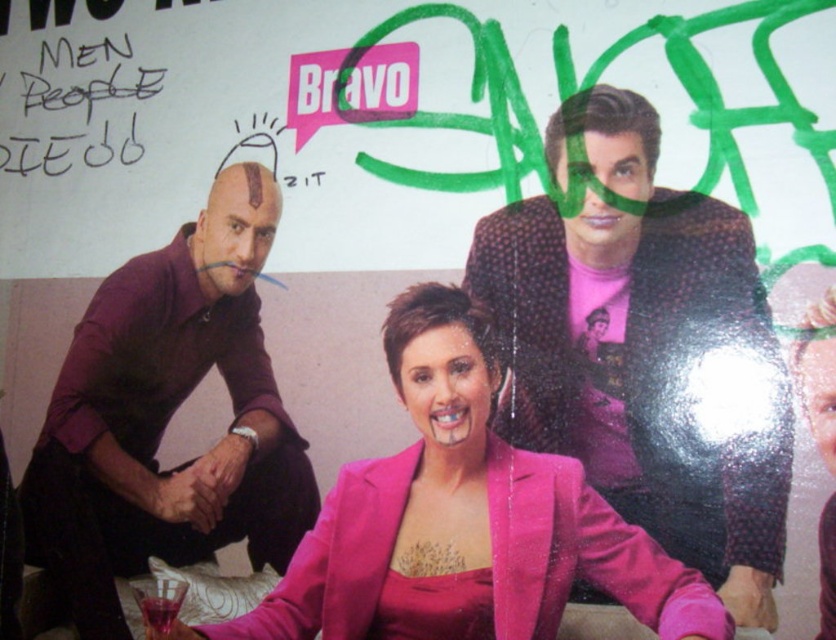
You are designing a poster layout and need to ensure that the pink satin blazer at center and the black handwritten text at upper left are both visible. Given their sizes, which object should be placed closer to the viewer to maintain visual balance?

The pink satin blazer at center is larger than the black handwritten text at upper left, so to maintain visual balance, the black handwritten text at upper left should be placed closer to the viewer than the pink satin blazer at center.

You are a costume designer looking at the poster and need to locate the purple matte shirt at left. Where exactly is it positioned in the image?

The purple matte shirt at left is located at point 0.653 on the x axis and 0.202 on the y axis.

You are designing a poster and need to place a logo between the pink satin blazer at center and the purple matte shirt at left. The minimum distance required for the logo is 50 centimeters. Based on the scene description, will there be enough space?

The pink satin blazer at center is 49.18 centimeters away from the purple matte shirt at left, which is slightly less than the required 50 centimeters. Therefore, there is not enough space to place the logo between them.